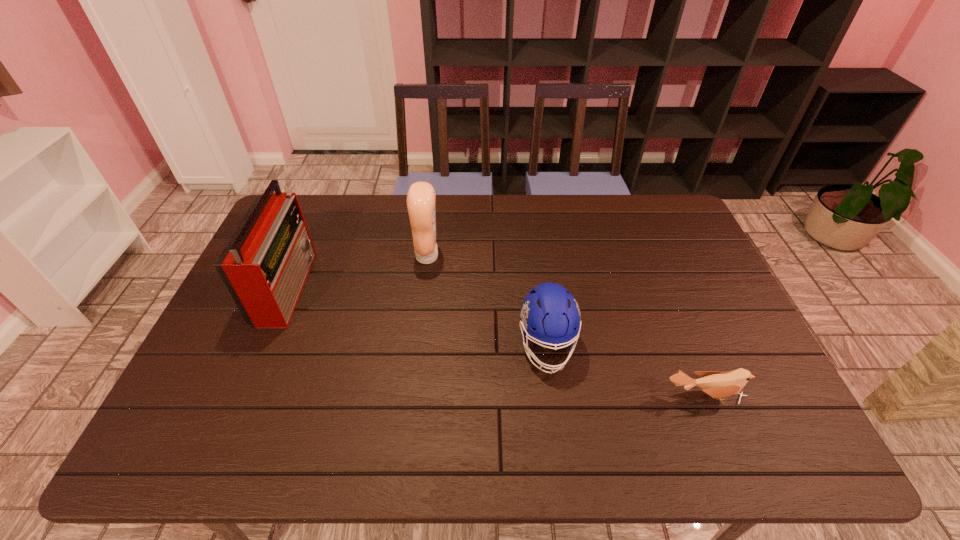
This screenshot has height=540, width=960. Find the location of `object present at the left edge`. object present at the left edge is located at coordinates (265, 264).

Locate an element on the screen. This screenshot has height=540, width=960. object present at the right edge is located at coordinates (719, 385).

Identify the location of free location at the far edge. Image resolution: width=960 pixels, height=540 pixels. (377, 212).

What are the coordinates of `free space at the near edge of the desktop` in the screenshot? It's located at (562, 432).

Find the location of a particular element. This screenshot has width=960, height=540. vacant area at the left edge is located at coordinates 241,316.

The height and width of the screenshot is (540, 960). I want to click on vacant space at the right edge, so click(704, 286).

Image resolution: width=960 pixels, height=540 pixels. In order to click on vacant space at the far right corner in this screenshot , I will do `click(655, 228)`.

Locate an element on the screen. The image size is (960, 540). free space between the third object from right to left and the third object from left to right is located at coordinates (487, 301).

You are a GUI agent. You are given a task and a screenshot of the screen. Output one action in this format:
    pyautogui.click(x=<x>, y=<y>)
    Task: Click on the free space between the condiment and the third object from left to right
    This screenshot has height=540, width=960.
    Given the screenshot: What is the action you would take?
    pyautogui.click(x=487, y=301)

The image size is (960, 540). I want to click on free space that is in between the football helmet and the condiment, so click(487, 301).